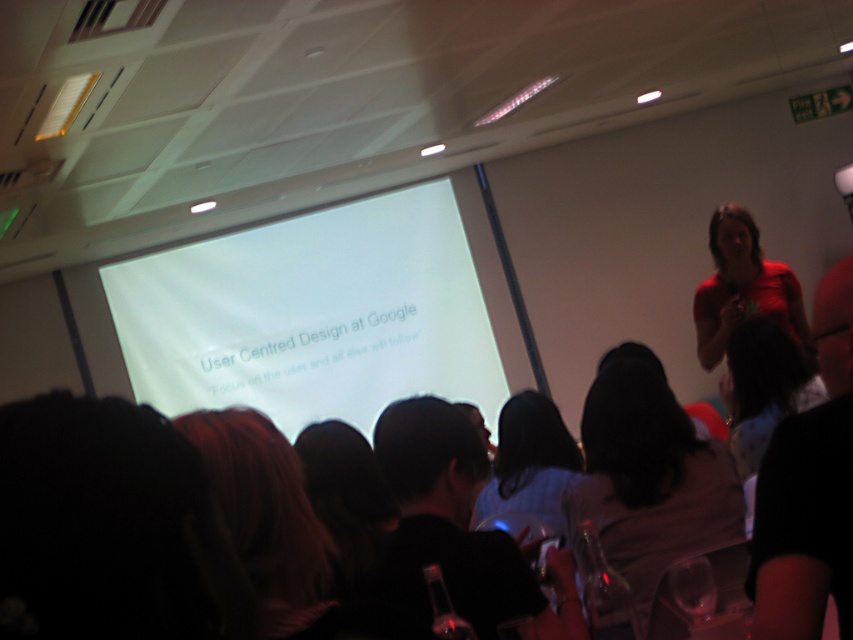
You are an attendee at the presentation and you see the point at coordinates [650,480]. What is the closest object to this point?

The point at coordinates [650,480] is on silky black hair at center, so the closest object to this point is silky black hair at center.

You are organizing a presentation and need to ensure that the white matte projection screen at center is visible to everyone in the room. Considering the dark brown hair at lower left, which object is wider and might block the view if placed in front of the screen?

The white matte projection screen at center is wider than the dark brown hair at lower left, so placing the dark brown hair at lower left in front of the screen would not block its view since the screen is wider.

You are a photographer standing at the back of the room. You want to take a photo of the silky black hair at center and the light blue shirt at center so that both are clearly visible. Given that your camera has a minimum focus distance of 30 centimeters, will you be able to capture both subjects in focus?

The silky black hair at center is 34.17 centimeters from the light blue shirt at center. Since the minimum focus distance of the camera is 30 centimeters, the distance between them is sufficient for both subjects to be in focus.